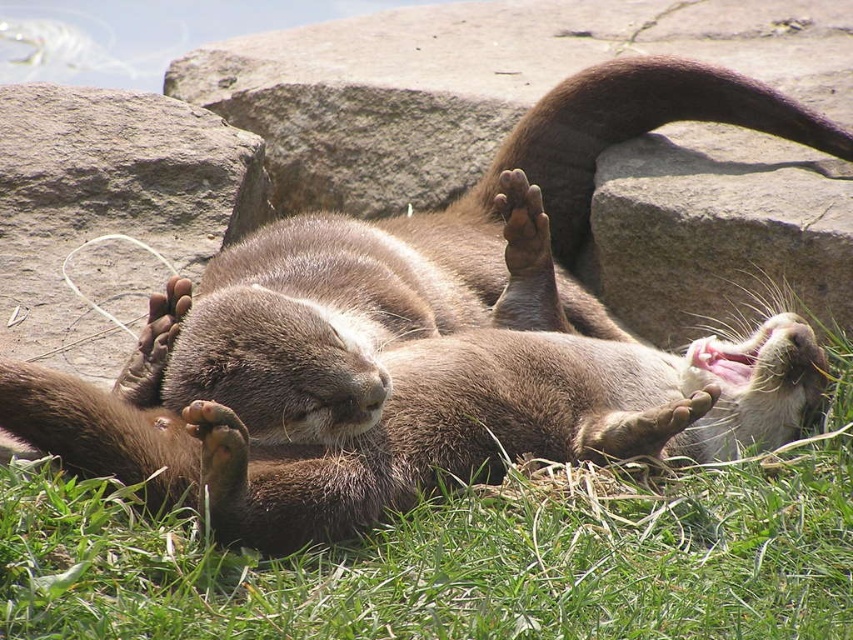
You are a photographer trying to capture a closeup of the brown furry paw at center. However, you notice the gray rock at upper center is blocking your view. Can you still take the photo without moving the rock?

The gray rock at upper center is closer to the viewer than the brown furry paw at center, so the rock is blocking the direct line of sight to the paw. To take the closeup without moving the rock, you would need to adjust your angle or position to frame around the obstruction.

Consider the image. You are standing at the point labeled point (462, 556). Looking around, you see two otters lying on their backs nearby. Which direction should you move to reach the green soft grass at lower center?

The point labeled point (462, 556) corresponds to the green soft grass at lower center, so you are already at the green soft grass at lower center.

Based on the photo, you are observing two points in the image of the otters. Which point, point (131, 120) or point (541, 221), is closer to you?

Point (131, 120) is closer to you because it is further to the camera than point (541, 221).